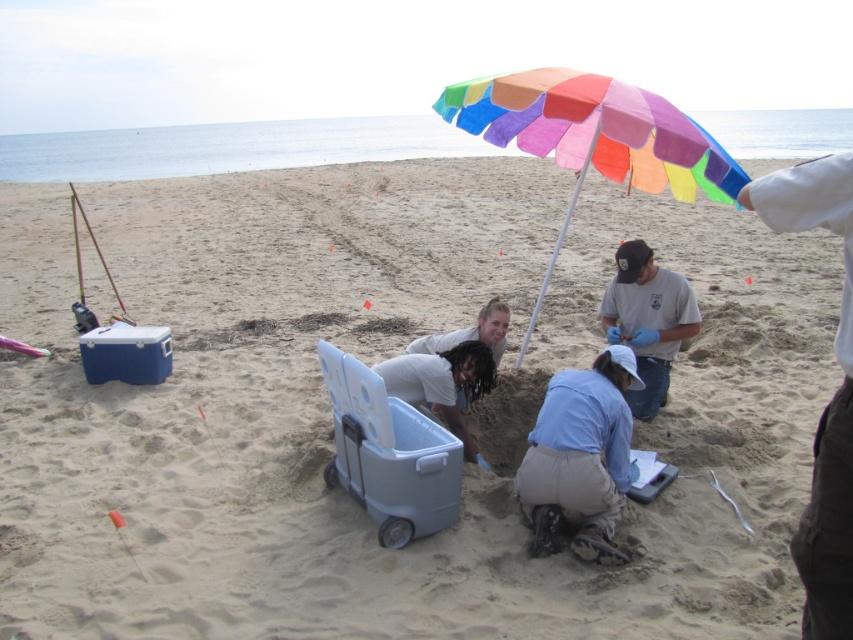
Question: Is white cotton shirt at upper right in front of gray plastic cooler at center?

Choices:
 (A) no
 (B) yes

Answer: (B)

Question: Can you confirm if white cotton shirt at upper right is positioned to the left of matte white shirt at center?

Choices:
 (A) no
 (B) yes

Answer: (B)

Question: Is matte white shirt at center below white matte cooler at center?

Choices:
 (A) yes
 (B) no

Answer: (B)

Question: Which point is farther to the camera?

Choices:
 (A) white matte cooler at center
 (B) gray plastic cooler at center
 (C) white cotton shirt at upper right
 (D) matte white shirt at center

Answer: (D)

Question: Which point appears farthest from the camera in this image?

Choices:
 (A) (589, 516)
 (B) (625, 160)

Answer: (B)

Question: Which object is farther from the camera taking this photo?

Choices:
 (A) white cotton shirt at upper right
 (B) blue cotton shirt at lower center
 (C) rainbow fabric umbrella at center
 (D) matte white shirt at center

Answer: (D)